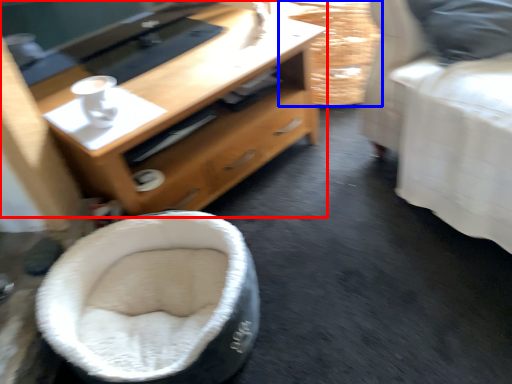
Question: Which point is further to the camera, desk (highlighted by a red box) or basket (highlighted by a blue box)?

Choices:
 (A) desk
 (B) basket

Answer: (B)